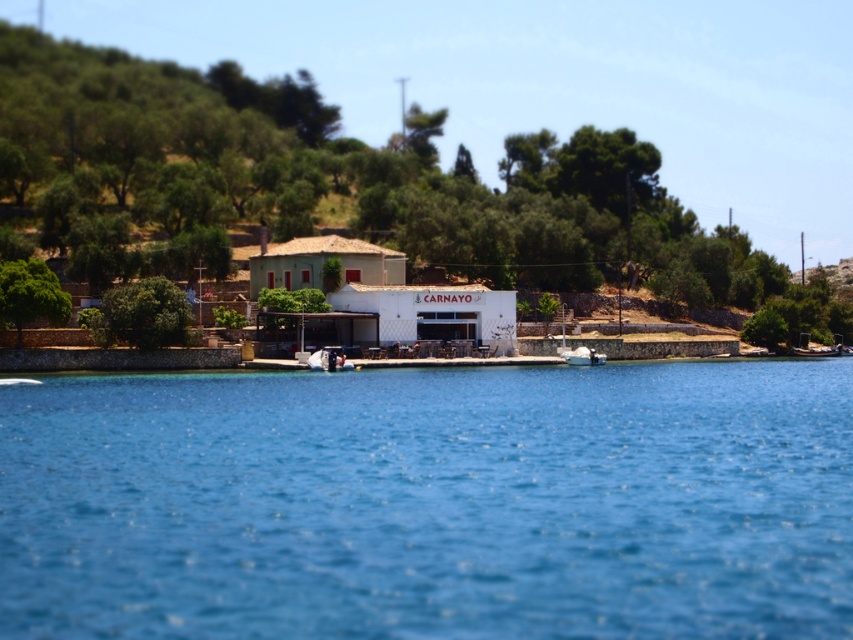
At what (x,y) coordinates should I click in order to perform the action: click on green grassy hillside at upper left. Please return your answer as a coordinate pair (x, y). This screenshot has width=853, height=640. Looking at the image, I should click on (329, 180).

Who is positioned more to the right, green grassy hillside at upper left or white matte boat at center?

From the viewer's perspective, white matte boat at center appears more on the right side.

Who is more distant from viewer, (x=781, y=301) or (x=592, y=352)?

Point (x=781, y=301)

Find the location of `green grassy hillside at upper left`. green grassy hillside at upper left is located at coordinates (329, 180).

Is blue water at center bigger than green grassy hillside at upper left?

Incorrect, blue water at center is not larger than green grassy hillside at upper left.

Locate an element on the screen. This screenshot has width=853, height=640. blue water at center is located at coordinates (431, 502).

Is blue water at center taller than white matte boat at center?

No, blue water at center is not taller than white matte boat at center.

Based on the photo, is blue water at center shorter than white matte boat at center?

Indeed, blue water at center has a lesser height compared to white matte boat at center.

At what (x,y) coordinates should I click in order to perform the action: click on blue water at center. Please return your answer as a coordinate pair (x, y). The width and height of the screenshot is (853, 640). Looking at the image, I should click on (431, 502).